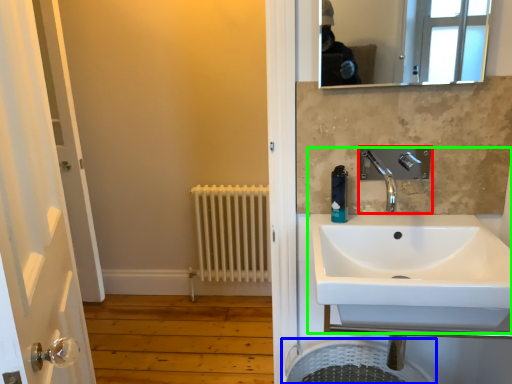
Question: Which is nearer to the tap (highlighted by a red box)? laundry basket (highlighted by a blue box) or sink (highlighted by a green box).

Choices:
 (A) laundry basket
 (B) sink

Answer: (B)